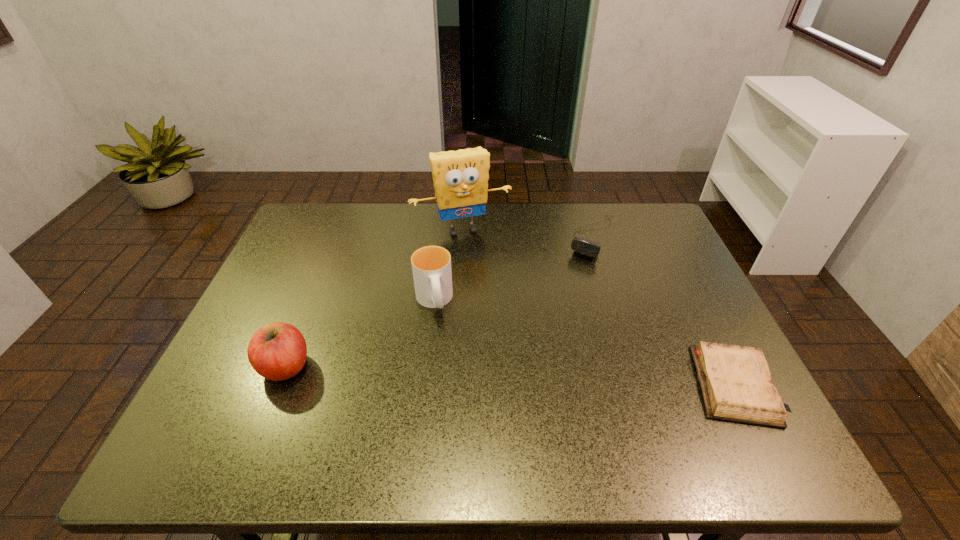
Identify the location of apple positioned at the near edge. The height and width of the screenshot is (540, 960). (277, 351).

The image size is (960, 540). Identify the location of diary that is at the near edge. (735, 381).

Identify the location of object that is at the left edge. This screenshot has height=540, width=960. (277, 351).

Identify the location of diary that is at the right edge. Image resolution: width=960 pixels, height=540 pixels. (735, 381).

The image size is (960, 540). In order to click on webcam at the right edge in this screenshot , I will do `click(582, 246)`.

At what (x,y) coordinates should I click in order to perform the action: click on object at the near left corner. Please return your answer as a coordinate pair (x, y). The width and height of the screenshot is (960, 540). Looking at the image, I should click on (277, 351).

Find the location of `object that is at the far right corner`. object that is at the far right corner is located at coordinates (582, 246).

You are a GUI agent. You are given a task and a screenshot of the screen. Output one action in this format:
    pyautogui.click(x=<x>, y=<y>)
    Task: Click on the object located at the near right corner
    This screenshot has width=960, height=540.
    Given the screenshot: What is the action you would take?
    pyautogui.click(x=735, y=381)

Image resolution: width=960 pixels, height=540 pixels. In the image, there is a desktop. In order to click on vacant space at the far edge in this screenshot , I will do `click(497, 205)`.

In the image, there is a desktop. Where is `vacant space at the near edge`? This screenshot has width=960, height=540. vacant space at the near edge is located at coordinates (428, 403).